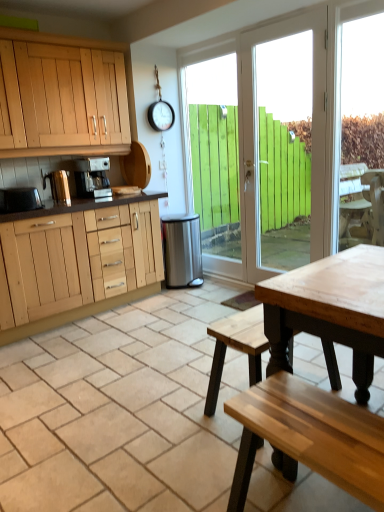
Question: Is white wood door at center located within satin silver coffee maker at center?

Choices:
 (A) yes
 (B) no

Answer: (B)

Question: Is satin silver coffee maker at center outside white wood door at center?

Choices:
 (A) yes
 (B) no

Answer: (A)

Question: From the image's perspective, is satin silver coffee maker at center beneath white wood door at center?

Choices:
 (A) yes
 (B) no

Answer: (B)

Question: Is satin silver coffee maker at center at the right side of white wood door at center?

Choices:
 (A) yes
 (B) no

Answer: (B)

Question: Is satin silver coffee maker at center smaller than white wood door at center?

Choices:
 (A) no
 (B) yes

Answer: (B)

Question: Is satin silver coffee maker at center oriented towards white wood door at center?

Choices:
 (A) no
 (B) yes

Answer: (A)

Question: Can you confirm if white wood door at center is positioned to the right of satin silver coffee maker at center?

Choices:
 (A) no
 (B) yes

Answer: (B)

Question: Can you confirm if white wood door at center is bigger than satin silver coffee maker at center?

Choices:
 (A) no
 (B) yes

Answer: (B)

Question: Does white wood door at center lie in front of satin silver coffee maker at center?

Choices:
 (A) no
 (B) yes

Answer: (B)

Question: From a real-world perspective, is white wood door at center on top of satin silver coffee maker at center?

Choices:
 (A) yes
 (B) no

Answer: (B)

Question: Can you confirm if white wood door at center is taller than satin silver coffee maker at center?

Choices:
 (A) yes
 (B) no

Answer: (A)

Question: Can you confirm if white wood door at center is shorter than satin silver coffee maker at center?

Choices:
 (A) yes
 (B) no

Answer: (B)

Question: Is brushed metal kettle at left, the 2th appliance viewed from the front, looking in the opposite direction of metallic silver toaster at left, acting as the 3th appliance starting from the back?

Choices:
 (A) no
 (B) yes

Answer: (A)